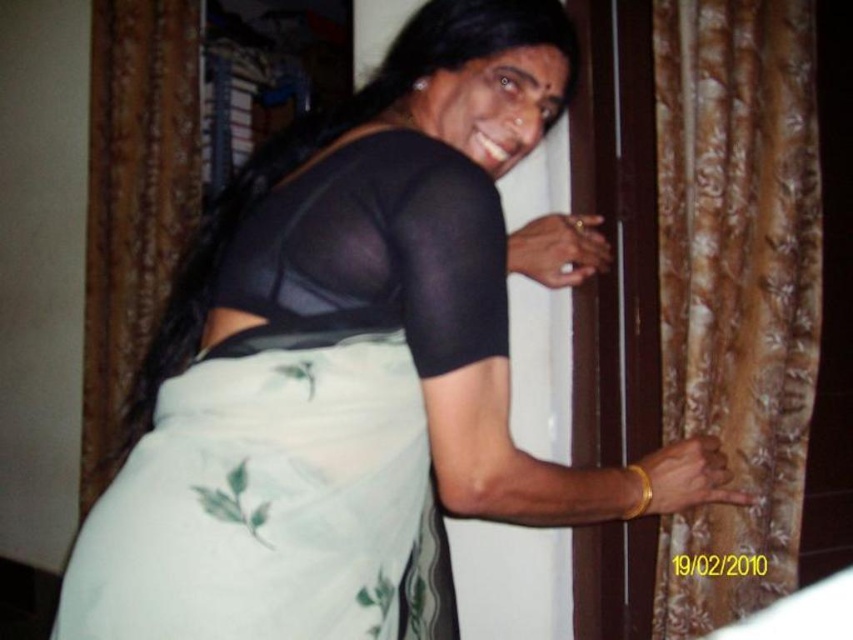
Can you confirm if white sheer fabric dress at center is positioned above gold floral fabric curtain at right?

Actually, white sheer fabric dress at center is below gold floral fabric curtain at right.

From the picture: Between white sheer fabric dress at center and gold floral fabric curtain at right, which one appears on the right side from the viewer's perspective?

From the viewer's perspective, gold floral fabric curtain at right appears more on the right side.

You are a GUI agent. You are given a task and a screenshot of the screen. Output one action in this format:
    pyautogui.click(x=<x>, y=<y>)
    Task: Click on the white sheer fabric dress at center
    The image size is (853, 640).
    Given the screenshot: What is the action you would take?
    pyautogui.click(x=308, y=419)

Between gold floral fabric curtain at right and brown textured curtain at left, which one has less height?

Standing shorter between the two is gold floral fabric curtain at right.

Locate an element on the screen. gold floral fabric curtain at right is located at coordinates (735, 289).

Find the location of `gold floral fabric curtain at right`. gold floral fabric curtain at right is located at coordinates point(735,289).

Is white sheer fabric dress at center to the right of brown textured curtain at left from the viewer's perspective?

Indeed, white sheer fabric dress at center is positioned on the right side of brown textured curtain at left.

Can you confirm if white sheer fabric dress at center is bigger than brown textured curtain at left?

No.

Identify the location of white sheer fabric dress at center. (308, 419).